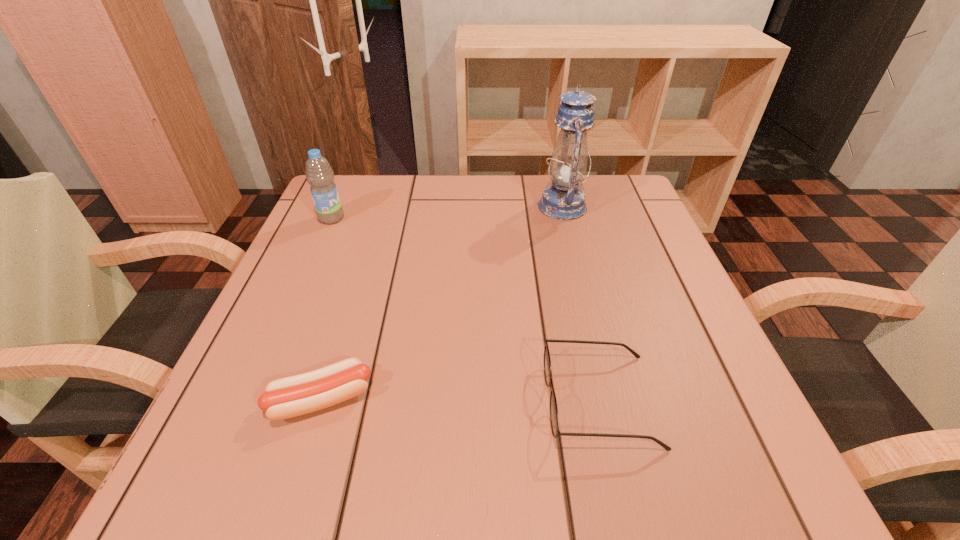
Image resolution: width=960 pixels, height=540 pixels. I want to click on the tallest object, so click(563, 200).

Where is `the second tallest object`? the second tallest object is located at coordinates (319, 174).

At what (x,y) coordinates should I click in order to perform the action: click on the third tallest object. Please return your answer as a coordinate pair (x, y). This screenshot has width=960, height=540. Looking at the image, I should click on (554, 418).

Image resolution: width=960 pixels, height=540 pixels. I want to click on the shortest object, so click(288, 397).

In order to click on vacant space located 0.360m on the front-facing side of the lantern in this screenshot , I will do `click(389, 206)`.

Identify the location of vacant space positioned 0.320m on the front-facing side of the lantern. This screenshot has width=960, height=540. (405, 206).

Image resolution: width=960 pixels, height=540 pixels. Identify the location of vacant space located on the front-facing side of the lantern. (385, 206).

Find the location of a particular element. The width and height of the screenshot is (960, 540). blank area located 0.300m on the front of the third shortest object is located at coordinates (285, 325).

This screenshot has height=540, width=960. Find the location of `vacant space situated 0.200m on the front-facing side of the spectacles`. vacant space situated 0.200m on the front-facing side of the spectacles is located at coordinates (414, 401).

Where is `free space located on the front-facing side of the spectacles`? The image size is (960, 540). free space located on the front-facing side of the spectacles is located at coordinates (328, 401).